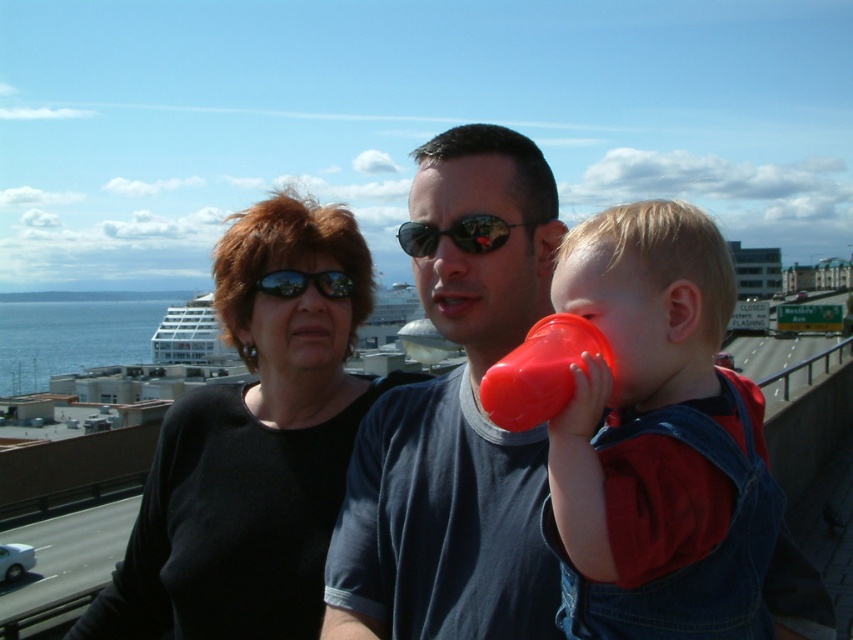
Image resolution: width=853 pixels, height=640 pixels. What do you see at coordinates (253, 448) in the screenshot?
I see `black matte shirt at center` at bounding box center [253, 448].

Image resolution: width=853 pixels, height=640 pixels. In order to click on black matte shirt at center in this screenshot , I will do `click(253, 448)`.

This screenshot has height=640, width=853. In order to click on black matte shirt at center in this screenshot , I will do `click(253, 448)`.

Is point (527, 243) closer to viewer compared to point (325, 456)?

Yes, point (527, 243) is closer to viewer.

Does point (491, 444) come behind point (218, 595)?

No, (491, 444) is closer to viewer.

Is point (457, 288) positioned behind point (341, 248)?

No.

You are a GUI agent. You are given a task and a screenshot of the screen. Output one action in this format:
    pyautogui.click(x=<x>, y=<y>)
    Task: Click on the matte black shirt at center
    The image size is (853, 640).
    Given the screenshot: What is the action you would take?
    pyautogui.click(x=456, y=419)

Is point (250, 253) positioned after point (506, 232)?

Yes, it is.

This screenshot has width=853, height=640. What do you see at coordinates (253, 448) in the screenshot?
I see `black matte shirt at center` at bounding box center [253, 448].

Between point (291, 557) and point (500, 218), which one is positioned in front?

Point (500, 218)

I want to click on black matte shirt at center, so click(253, 448).